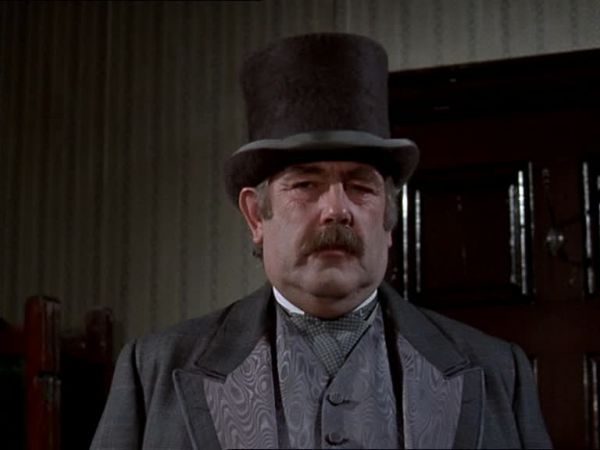
Where is `door`? door is located at coordinates (552, 154).